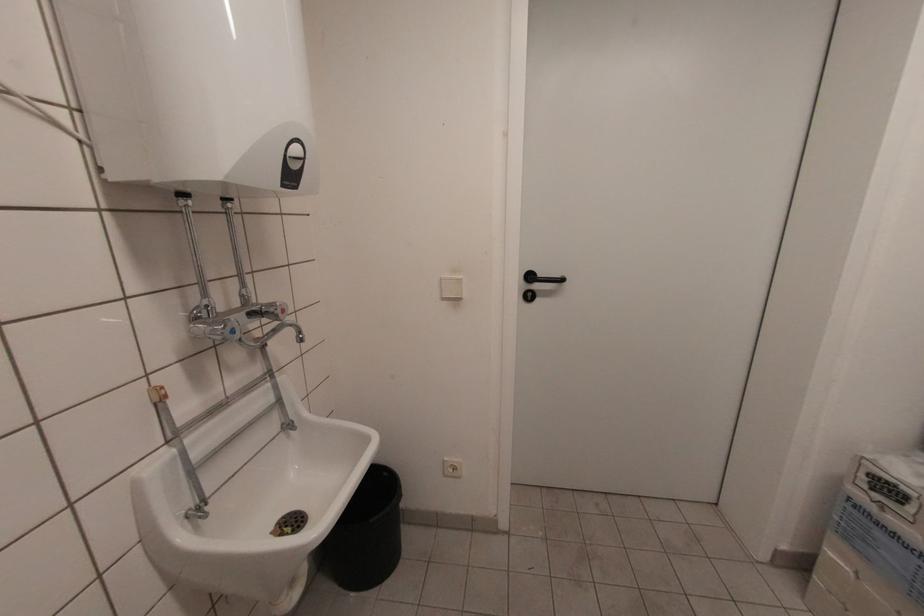
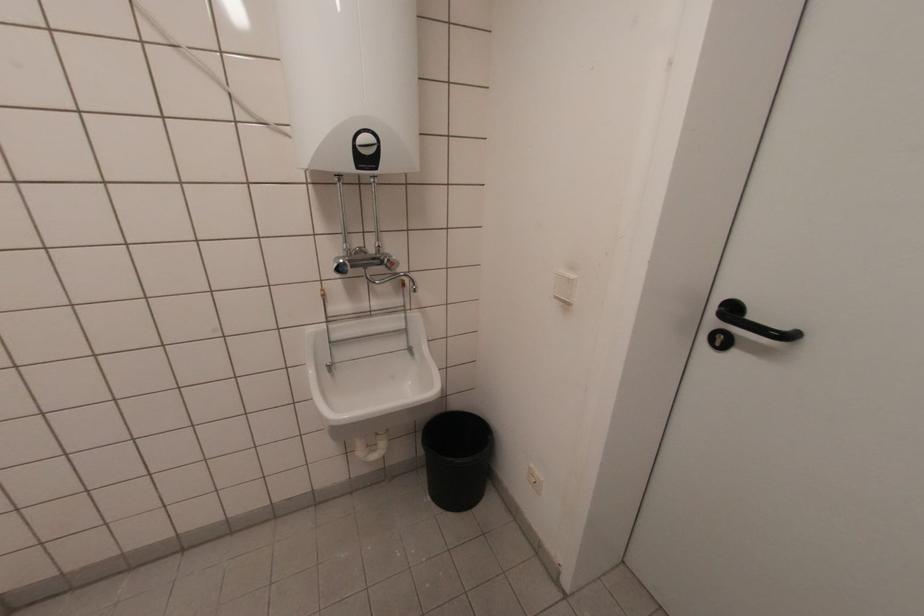
In the second image, find the point that corresponds to (460,277) in the first image.

(573, 277)